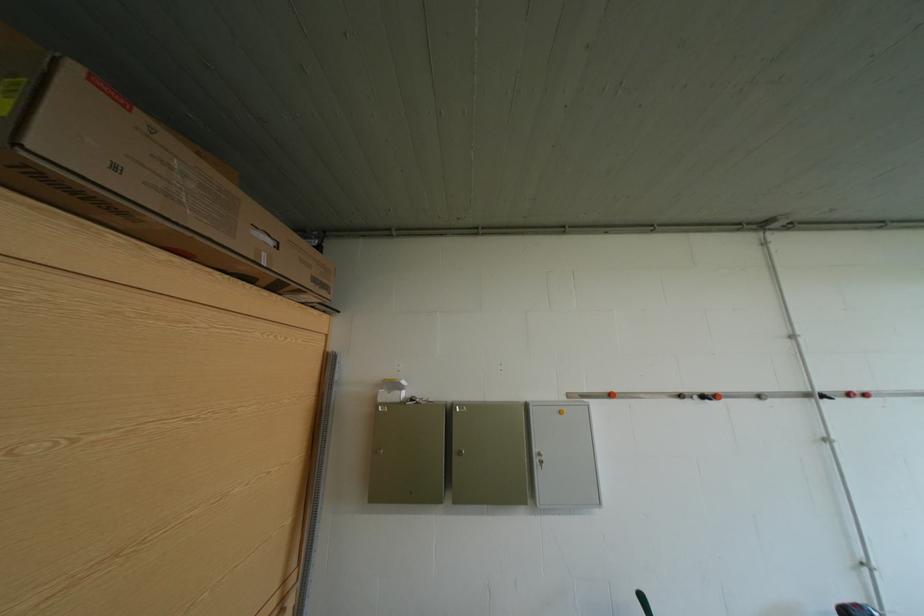
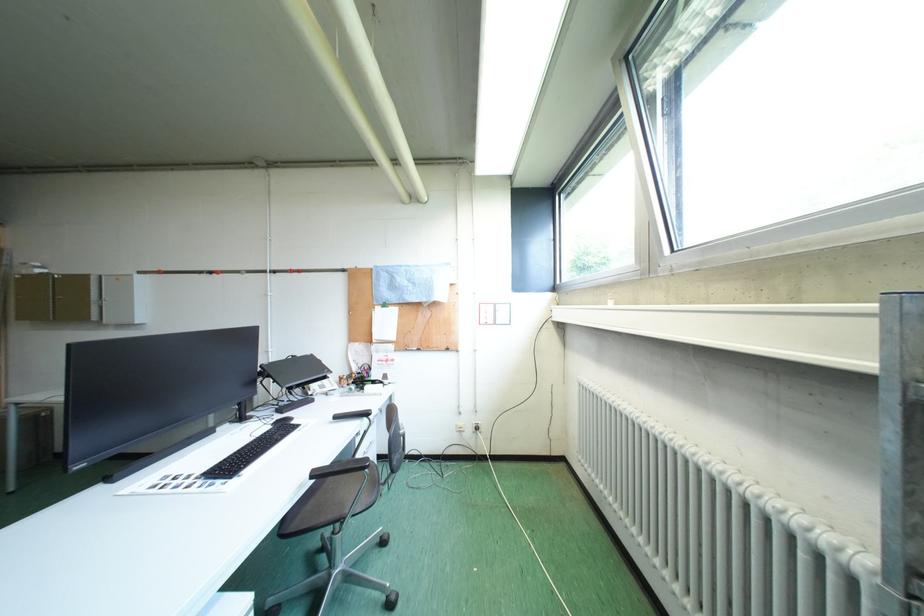
Question: The images are taken continuously from a first-person perspective. In which direction are you moving?

Choices:
 (A) Left
 (B) Right
 (C) Forward
 (D) Backward

Answer: (B)